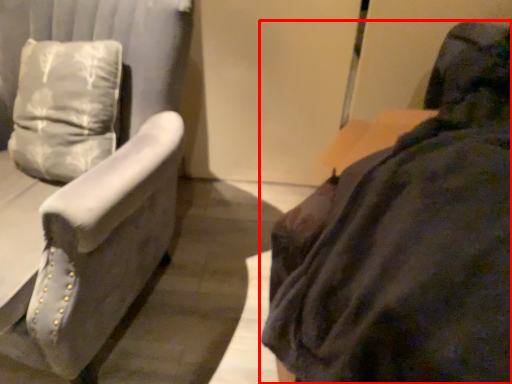
Question: In this image, where is furniture (annotated by the red box) located relative to furniture?

Choices:
 (A) left
 (B) right

Answer: (B)